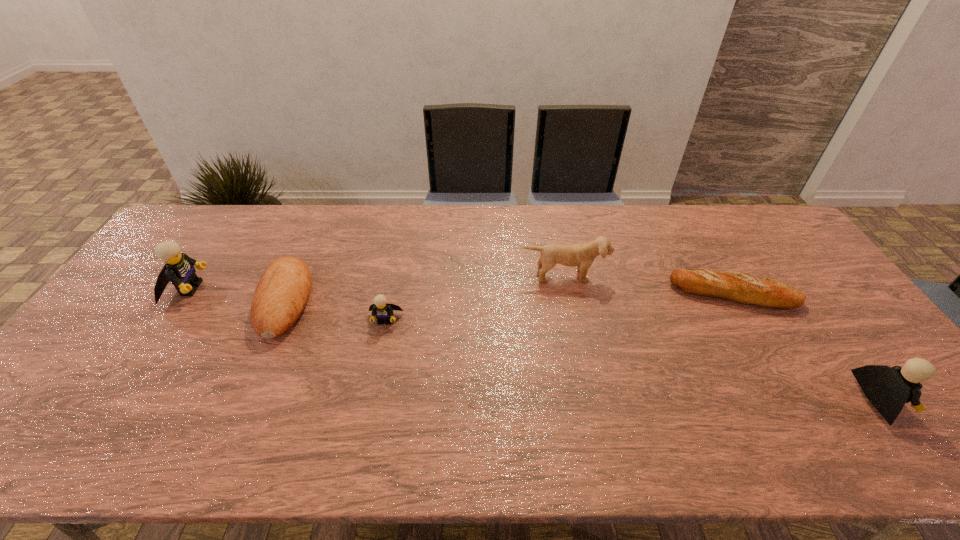
To ensure equal spacing by inserting another Lego among them, please point out a vacant spot for this new Lego. Please provide its 2D coordinates. Your answer should be formatted as a tuple, i.e. [(x, y)], where the tuple contains the x and y coordinates of a point satisfying the conditions above.

[(613, 357)]